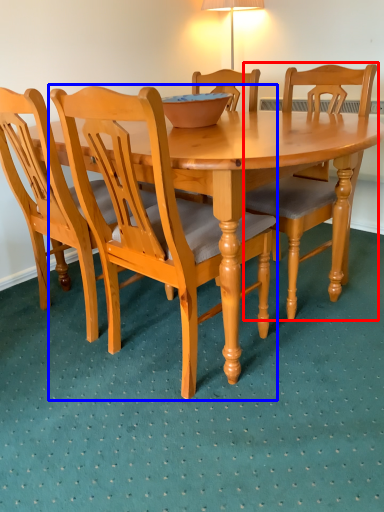
Question: Which object is closer to the camera taking this photo, chair (highlighted by a red box) or chair (highlighted by a blue box)?

Choices:
 (A) chair
 (B) chair

Answer: (B)